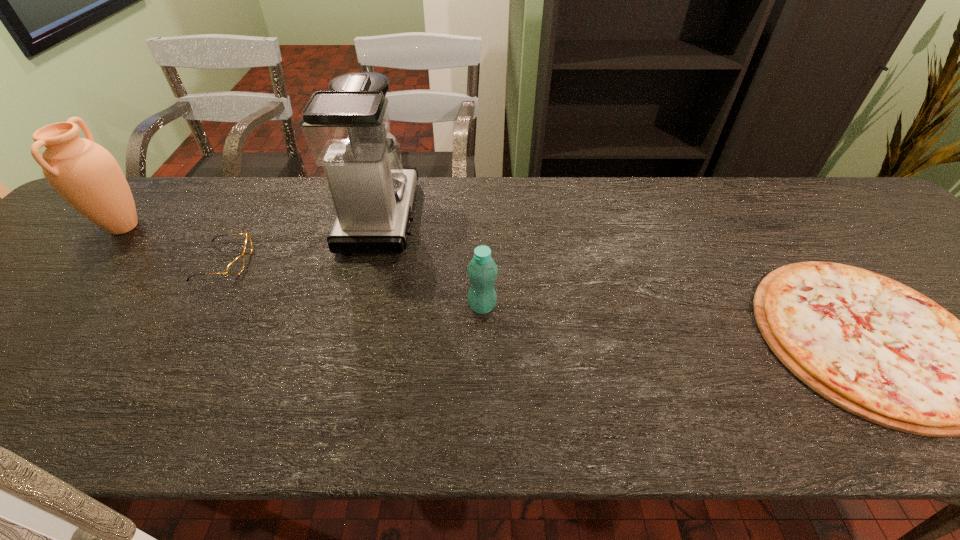
In order to click on the third object from right to left in this screenshot , I will do `click(347, 129)`.

Identify the location of coffee maker. The height and width of the screenshot is (540, 960). (347, 129).

Find the location of a particular element. This screenshot has width=960, height=540. the leftmost object is located at coordinates (85, 174).

In order to click on urn in this screenshot , I will do `click(85, 174)`.

The image size is (960, 540). In order to click on the third shortest object in this screenshot , I will do `click(482, 271)`.

Identify the location of water bottle. (482, 271).

Find the location of a particular element. Image resolution: width=960 pixels, height=540 pixels. spectacles is located at coordinates (235, 267).

At what (x,y) coordinates should I click in order to perform the action: click on the second shortest object. Please return your answer as a coordinate pair (x, y). Looking at the image, I should click on (235, 267).

The width and height of the screenshot is (960, 540). In order to click on vacant space located at the front of the tallest object where the controls are located in this screenshot , I will do `click(485, 216)`.

Image resolution: width=960 pixels, height=540 pixels. Find the location of `vacant space situated 0.150m on the front of the leftmost object`. vacant space situated 0.150m on the front of the leftmost object is located at coordinates (68, 290).